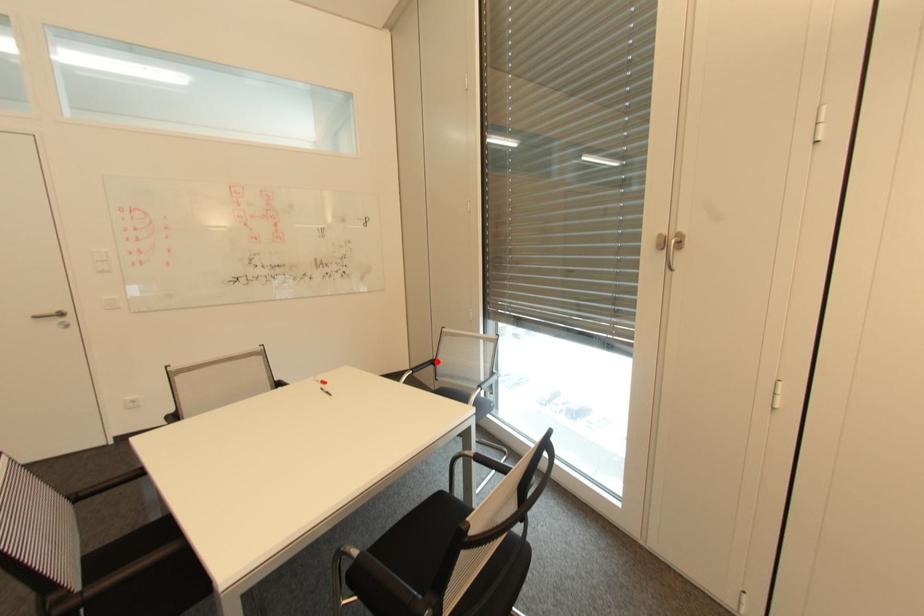
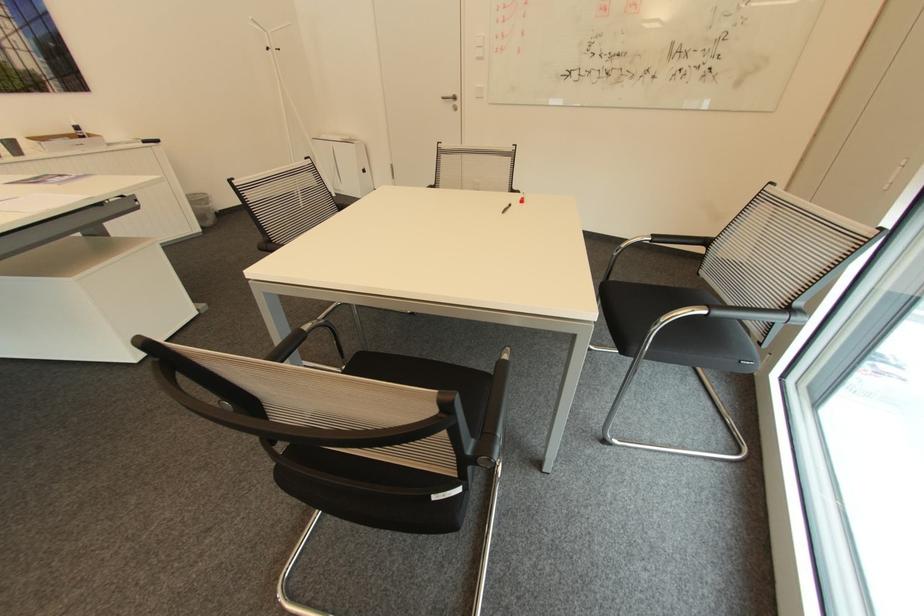
In the second image, find the point that corresponds to the highlighted location in the first image.

(710, 241)